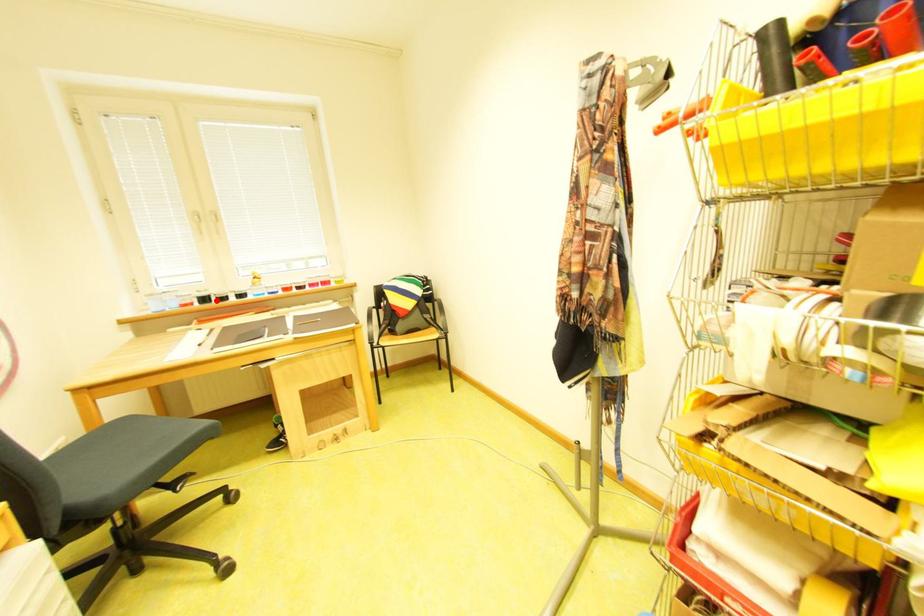
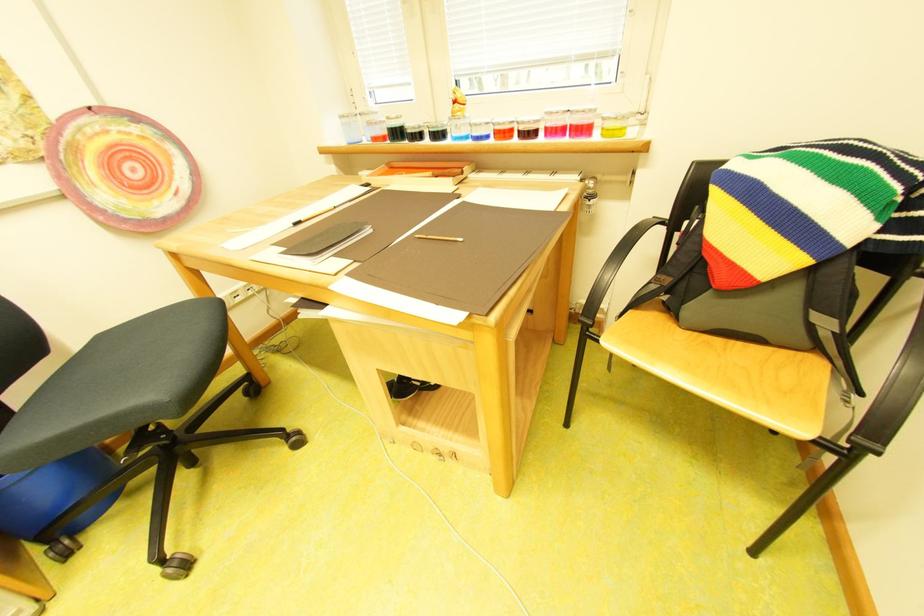
Question: I am providing you with two images of the same scene from different viewpoints. A red point is shown in image1. For the corresponding object point in image2, is it positioned nearer or farther from the camera?

Choices:
 (A) Nearer
 (B) Farther

Answer: (A)